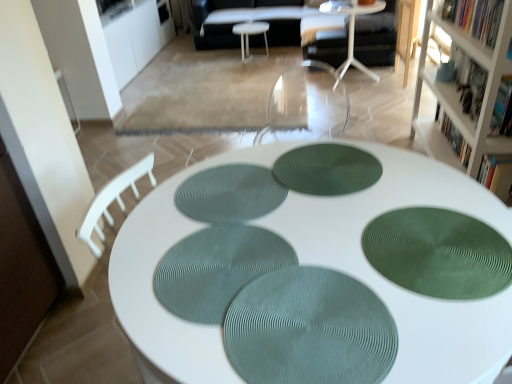
Locate an element on the screen. Image resolution: width=512 pixels, height=384 pixels. free space between green textured placemat at center, marked as the 3th mat in a left-to-right arrangement, and teal textured placemat at center, the third mat viewed from the right is located at coordinates (276, 214).